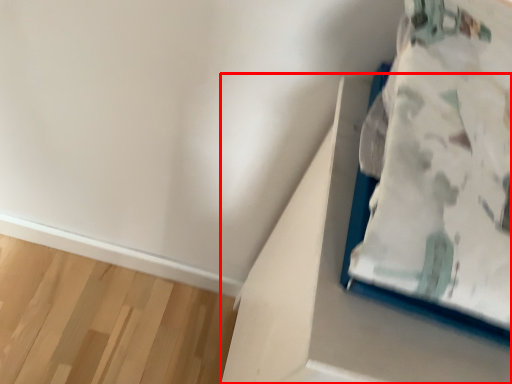
Question: Where is cardboard box (annotated by the red box) located in relation to furniture in the image?

Choices:
 (A) left
 (B) right

Answer: (B)